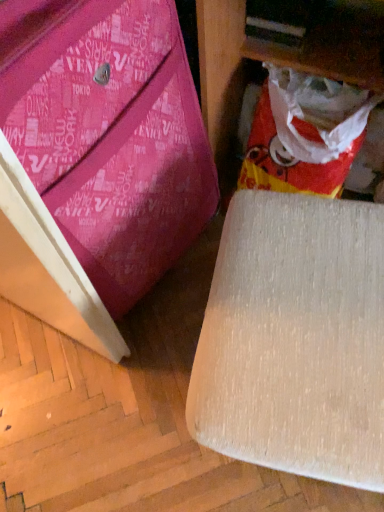
At what (x,y) coordinates should I click in order to perform the action: click on free space in front of pink fabric bag at lower left, which ranks as the 1th furniture in left-to-right order. Please return your answer as a coordinate pair (x, y). Image resolution: width=384 pixels, height=512 pixels. Looking at the image, I should click on (110, 391).